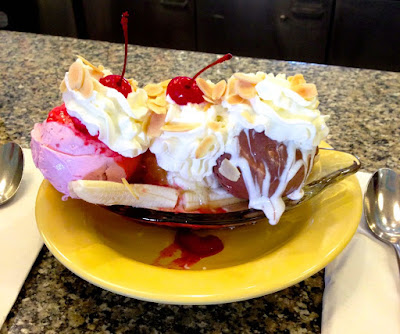
Where is `the left spoon`? the left spoon is located at coordinates (7, 172).